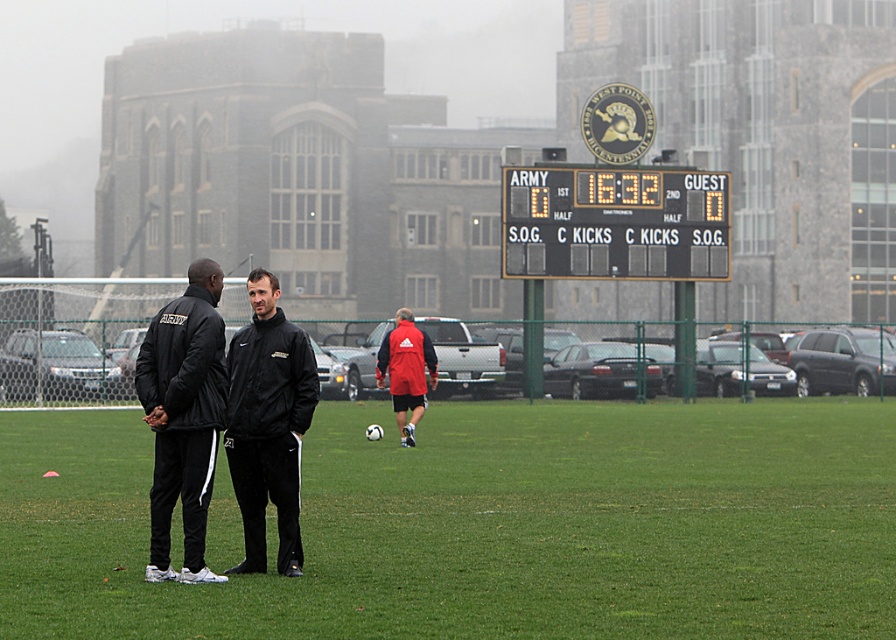
Is black matte jacket at left below black matte jacket at center?

Yes, black matte jacket at left is below black matte jacket at center.

Describe the element at coordinates (183, 417) in the screenshot. The width and height of the screenshot is (896, 640). I see `black matte jacket at left` at that location.

Who is more distant from viewer, (194,308) or (239,371)?

The point (239,371) is more distant.

Locate an element on the screen. The height and width of the screenshot is (640, 896). black matte jacket at left is located at coordinates (183, 417).

Can you confirm if green grass at center is positioned below black plastic scoreboard at upper center?

Correct, green grass at center is located below black plastic scoreboard at upper center.

The height and width of the screenshot is (640, 896). What are the coordinates of `green grass at center` in the screenshot? It's located at (485, 525).

Is green grass at center to the left of black matte jacket at left from the viewer's perspective?

In fact, green grass at center is to the right of black matte jacket at left.

Between green grass at center and black matte jacket at left, which one appears on the left side from the viewer's perspective?

black matte jacket at left is more to the left.

Between point (679, 508) and point (145, 349), which one is positioned behind?

The point (679, 508) is more distant.

Identify the location of green grass at center. (485, 525).